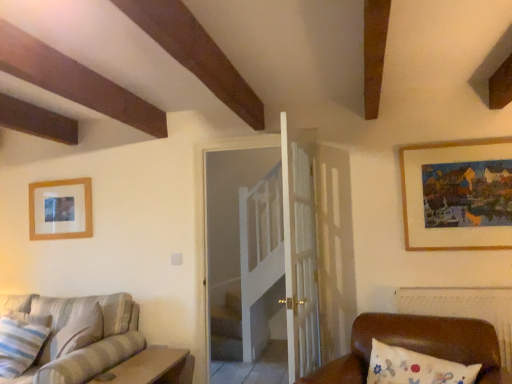
Where is `free space above wooden framed painting at upper right, marked as the second picture frame in a left-to-right arrangement (from a real-world perspective)`? free space above wooden framed painting at upper right, marked as the second picture frame in a left-to-right arrangement (from a real-world perspective) is located at coordinates (453, 145).